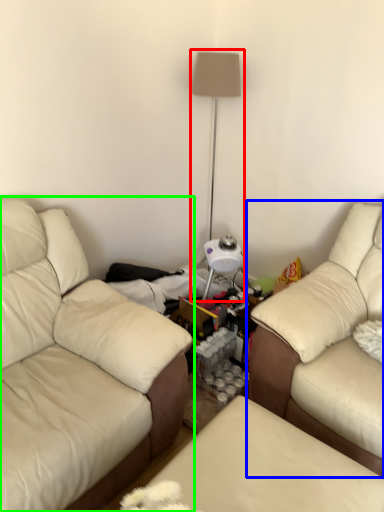
Question: Which object is the farthest from table lamp (highlighted by a red box)? Choose among these: studio couch (highlighted by a blue box) or studio couch (highlighted by a green box).

Choices:
 (A) studio couch
 (B) studio couch

Answer: (B)